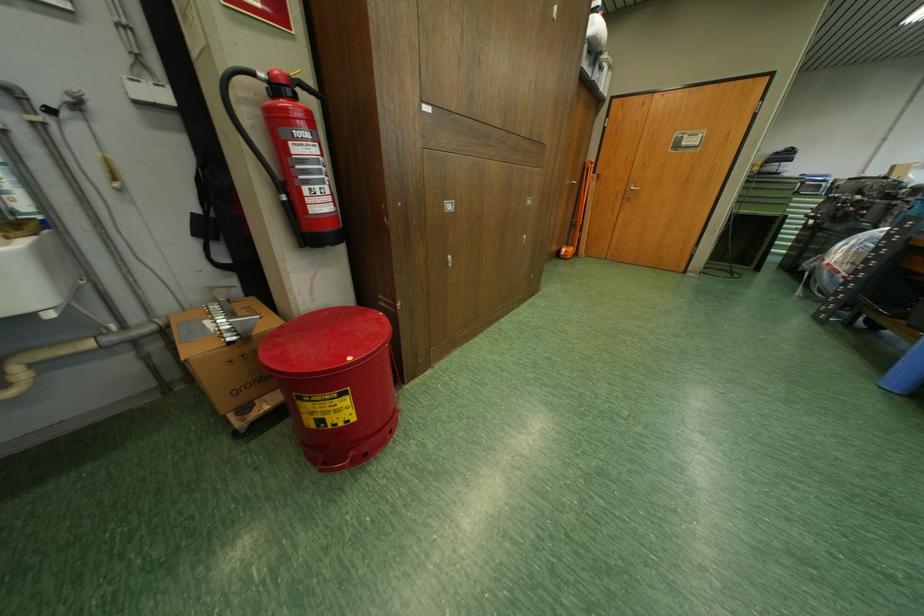
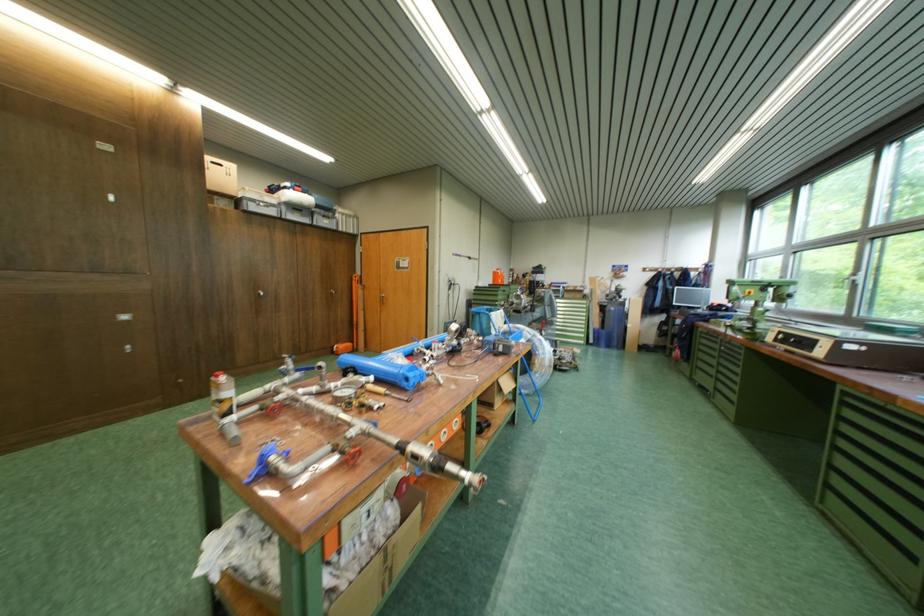
Where in the second image is the point corresponding to pixel 603 187 from the first image?

(371, 294)